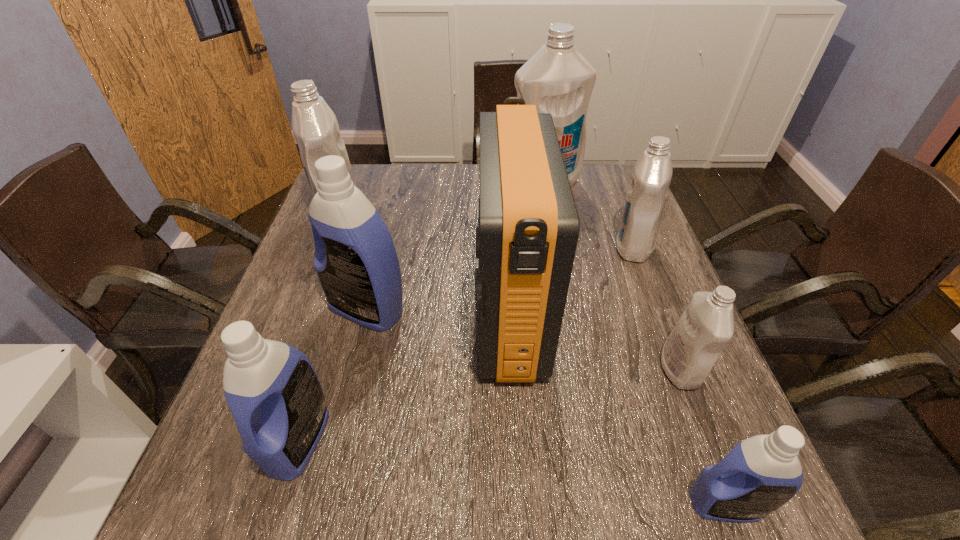
The image size is (960, 540). In order to click on the smallest blue detergent in this screenshot , I will do `click(760, 474)`.

Find the location of a particular element. vacant position located 0.180m on the left of the biggest white detergent is located at coordinates (450, 183).

What are the coordinates of `vacant space located on the front-facing side of the radio receiver` in the screenshot? It's located at (365, 315).

Image resolution: width=960 pixels, height=540 pixels. I want to click on free space located 0.300m on the front-facing side of the radio receiver, so click(x=343, y=315).

Find the location of a particular element. This screenshot has height=540, width=960. vacant space positioned 0.240m on the front-facing side of the radio receiver is located at coordinates (369, 315).

In order to click on vacant space located on the front of the leftmost white detergent in this screenshot , I will do `click(297, 339)`.

The width and height of the screenshot is (960, 540). Find the location of `blank space located on the right of the biggest blue detergent`. blank space located on the right of the biggest blue detergent is located at coordinates (479, 309).

At what (x,y) coordinates should I click in order to perform the action: click on vacant space located 0.130m on the left of the second smallest white detergent. Please return your answer as a coordinate pair (x, y). Looking at the image, I should click on (564, 247).

The image size is (960, 540). Identify the location of free spot located 0.230m on the right of the second smallest blue detergent. (455, 440).

Find the location of a particular element. Image resolution: width=960 pixels, height=540 pixels. vacant space located 0.100m on the front of the smallest white detergent is located at coordinates (708, 444).